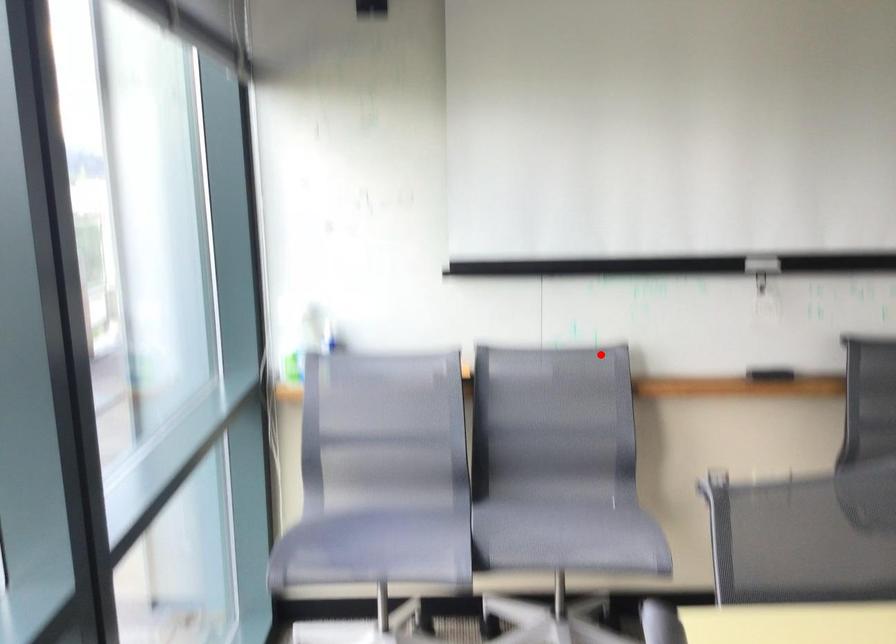
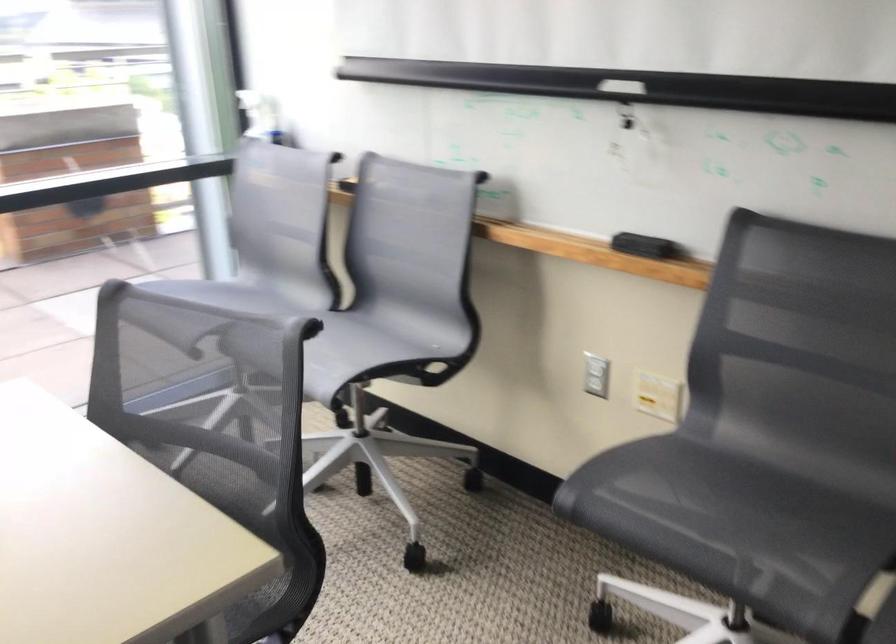
Question: I am providing you with two images of the same scene from different viewpoints. In image1, a red point is highlighted. Considering the same 3D point in image2, which of the following is correct?

Choices:
 (A) It is closer
 (B) It is farther

Answer: (A)